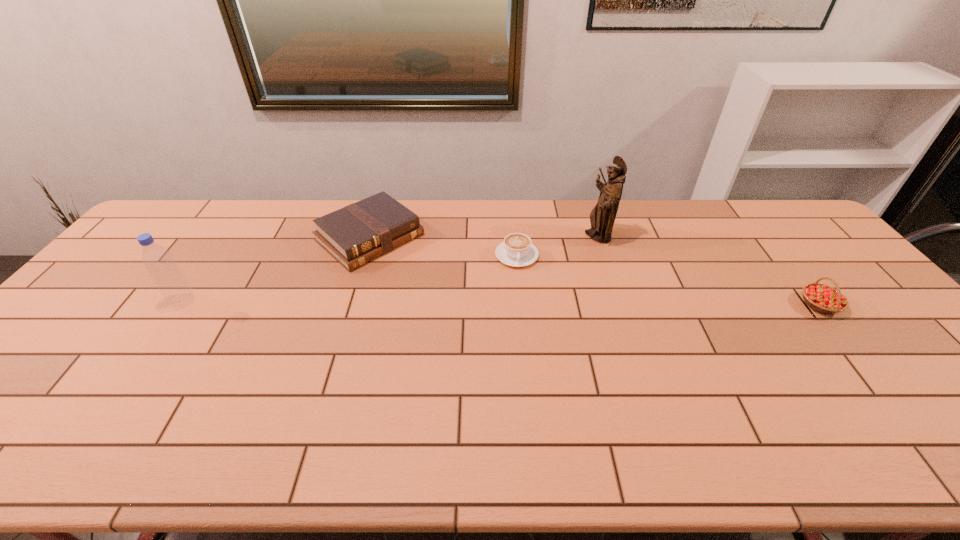
The width and height of the screenshot is (960, 540). I want to click on bottle, so click(x=169, y=279).

Image resolution: width=960 pixels, height=540 pixels. Identify the location of the second tallest object. (169, 279).

The image size is (960, 540). I want to click on strawberry, so click(x=822, y=298).

You are a GUI agent. You are given a task and a screenshot of the screen. Output one action in this format:
    pyautogui.click(x=<x>, y=<y>)
    Task: Click on the tallest object
    The height and width of the screenshot is (540, 960).
    Given the screenshot: What is the action you would take?
    pyautogui.click(x=602, y=217)

The height and width of the screenshot is (540, 960). What are the coordinates of `the second object from right to left` in the screenshot? It's located at (602, 217).

In order to click on cappuccino in this screenshot , I will do `click(517, 250)`.

The width and height of the screenshot is (960, 540). Find the location of `the shortest object`. the shortest object is located at coordinates (517, 250).

You are a GUI agent. You are given a task and a screenshot of the screen. Output one action in this format:
    pyautogui.click(x=<x>, y=<y>)
    Task: Click on the Bible
    The image size is (960, 540).
    Given the screenshot: What is the action you would take?
    pyautogui.click(x=360, y=232)

Identify the location of vacant space located on the front of the leftmost object. This screenshot has width=960, height=540. (151, 348).

Where is `free region located 0.050m on the left of the rightmost object`? free region located 0.050m on the left of the rightmost object is located at coordinates (781, 305).